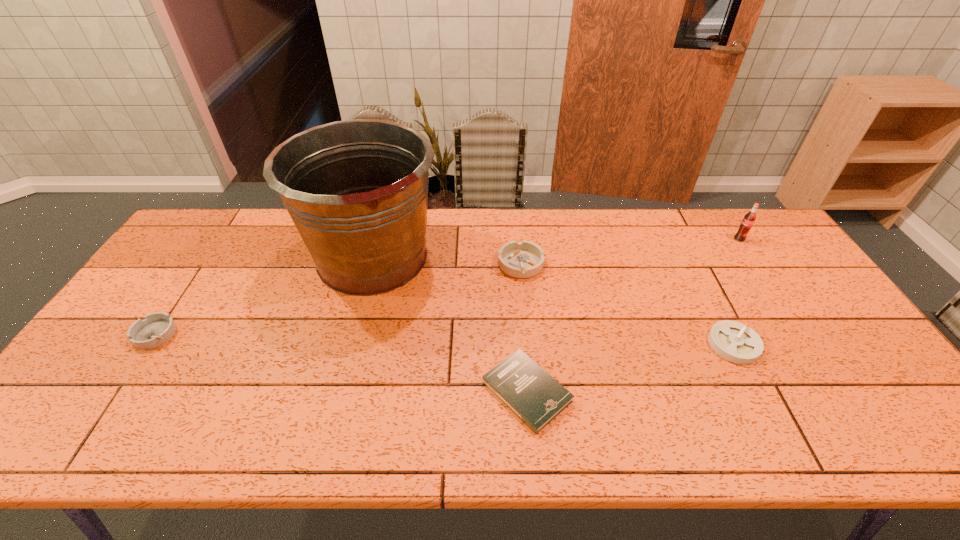
Where is `free area in between the rightmost ashtray and the third tallest object`? Image resolution: width=960 pixels, height=540 pixels. free area in between the rightmost ashtray and the third tallest object is located at coordinates (627, 305).

Where is `vacant area that lies between the second ashtray from right to left and the bucket`? vacant area that lies between the second ashtray from right to left and the bucket is located at coordinates (446, 261).

Image resolution: width=960 pixels, height=540 pixels. In order to click on vacant space in between the rightmost ashtray and the shortest object in this screenshot , I will do `click(630, 368)`.

Identify the location of free point between the leftmost object and the rightmost object. The width and height of the screenshot is (960, 540). (447, 287).

Image resolution: width=960 pixels, height=540 pixels. Find the location of `vacant space that's between the rightmost ashtray and the tallest ashtray`. vacant space that's between the rightmost ashtray and the tallest ashtray is located at coordinates (627, 305).

Identify the location of vacant space that's between the tallest ashtray and the rightmost ashtray. (627, 305).

This screenshot has height=540, width=960. Identify the location of unoccupied position between the rightmost ashtray and the leftmost object. (444, 339).

Locate an element on the screen. Image resolution: width=960 pixels, height=540 pixels. free space between the leftmost object and the shortest object is located at coordinates (341, 363).

Locate an element on the screen. The image size is (960, 540). vacant space that's between the shortest object and the second object from left to right is located at coordinates (449, 324).

Point out which object is positioned as the third nearest to the soda bottle. Please provide its 2D coordinates. Your answer should be formatted as a tuple, i.e. [(x, y)], where the tuple contains the x and y coordinates of a point satisfying the conditions above.

[(520, 383)]